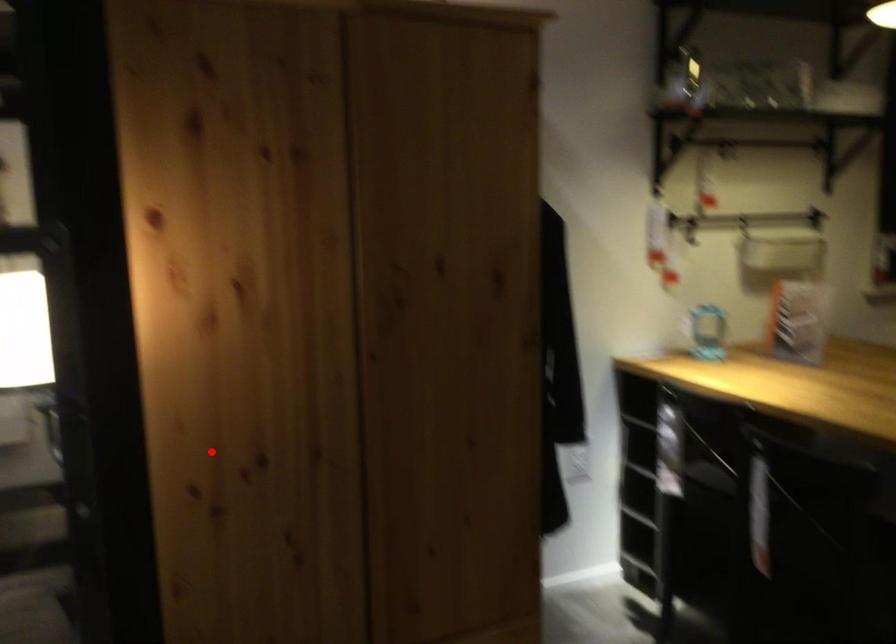
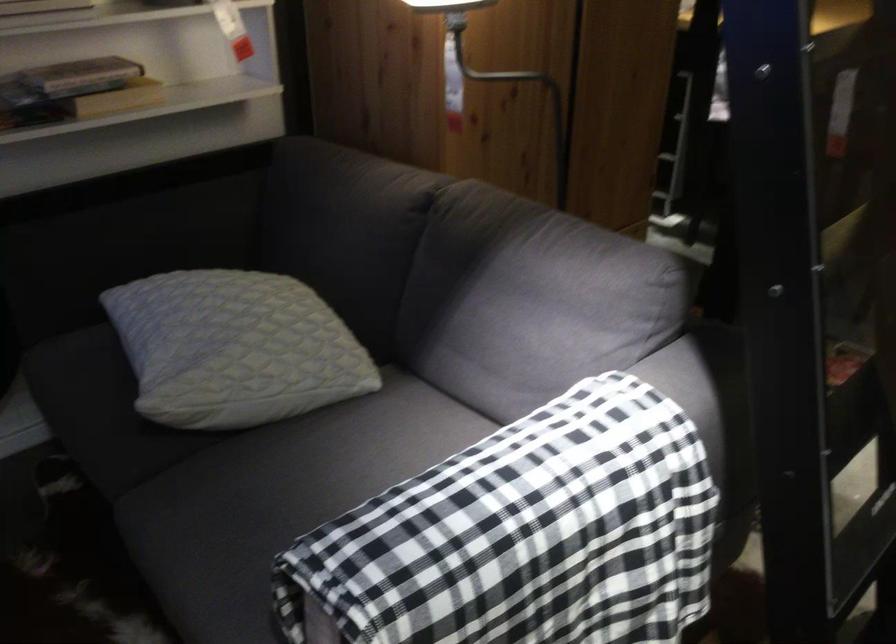
Question: A red point is marked in image1. In image2, is the corresponding 3D point closer to the camera or farther? Reply with the corresponding letter.

Choices:
 (A) The corresponding 3D point is closer.
 (B) The corresponding 3D point is farther.

Answer: (B)